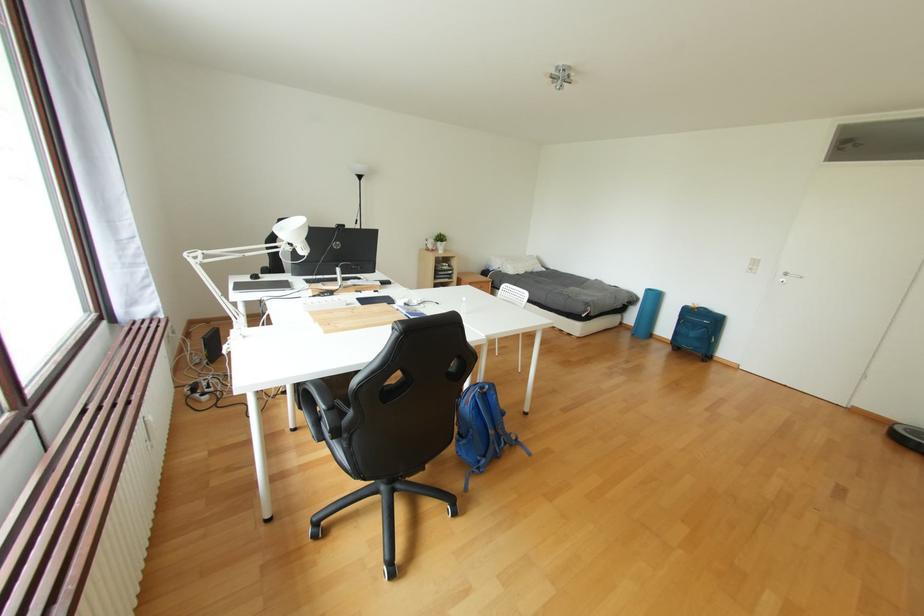
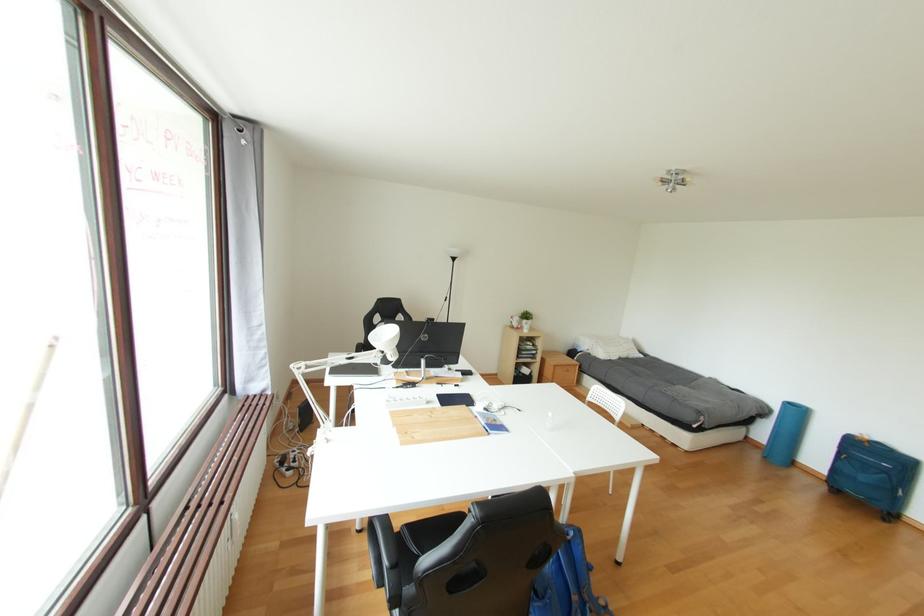
Question: The images are taken continuously from a first-person perspective. In which direction is your viewpoint rotating?

Choices:
 (A) Left
 (B) Right
 (C) Up
 (D) Down

Answer: (A)